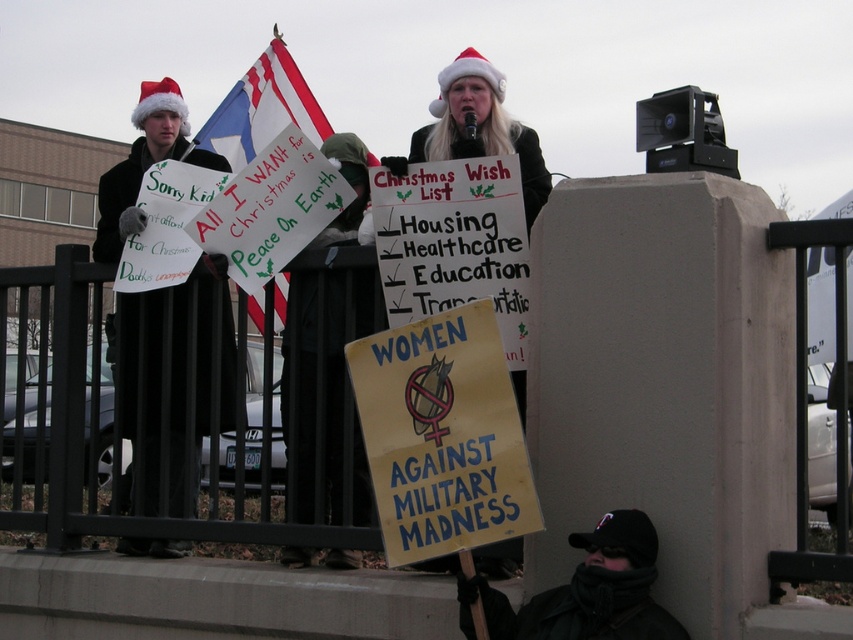
You are a photographer standing at the center of the protest scene. You want to capture a photo that includes both the seated protester with their sign and the black fabric Santa hat located at point (138, 164). Based on their positions, can you position yourself so that both elements are in the frame?

The black fabric Santa hat at point (138, 164) is located to the left of the seated protester with their sign. Since they are positioned along the same horizontal plane, you can position yourself centrally between them to include both in the frame.

You are a photographer trying to capture both the black fabric santa hat at left and the black woolen hat at lower right in a single shot. Which hat should you focus on first to ensure both are in the frame?

You should focus on the black fabric santa hat at left first because it is closer to you than the black woolen hat at lower right, ensuring both are in the frame.

You are a photographer trying to capture both the black fabric santa hat at left and the black fabric cape at center in a single shot. Which object should you focus on first to ensure both are in clear view?

You should focus on the black fabric santa hat at left first because it is closer to you than the black fabric cape at center, ensuring both will be in focus when using depth of field techniques.